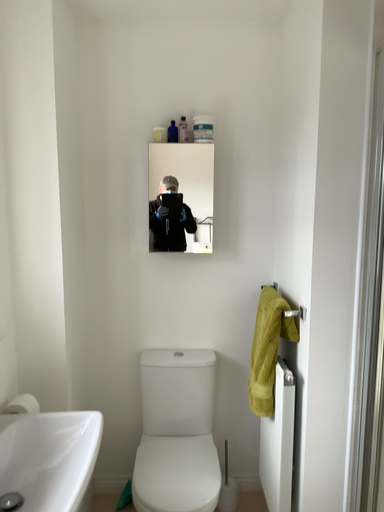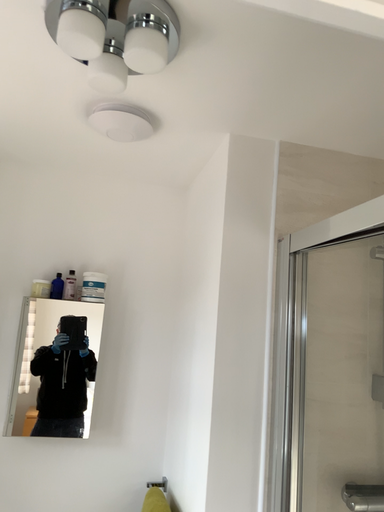
Question: How did the camera likely rotate when shooting the video?

Choices:
 (A) rotated right
 (B) rotated left

Answer: (A)